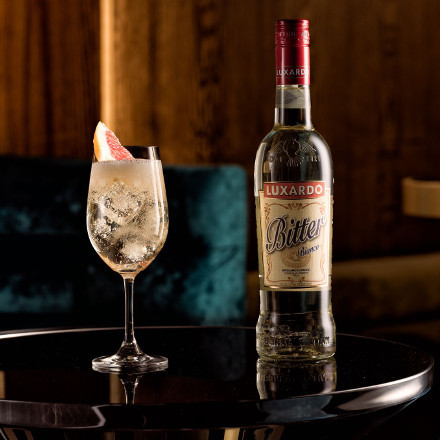
You are a GUI agent. You are given a task and a screenshot of the screen. Output one action in this format:
    pyautogui.click(x=<x>, y=<y>)
    Task: Click on the green chair back
    
    Given the screenshot: What is the action you would take?
    pyautogui.click(x=195, y=209)